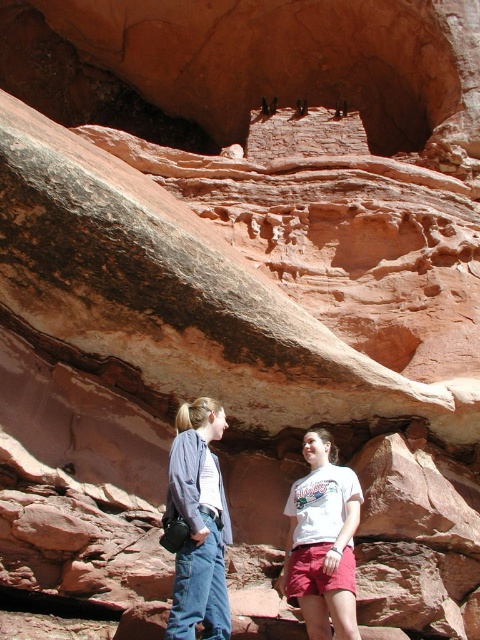
Is denim jacket at lower left thinner than white cotton t-shirt at center?

Yes.

Is point (181, 481) positioned in front of point (288, 493)?

Yes, point (181, 481) is in front of point (288, 493).

Measure the distance between point (175, 465) and camera.

A distance of 40.71 meters exists between point (175, 465) and camera.

You are a GUI agent. You are given a task and a screenshot of the screen. Output one action in this format:
    pyautogui.click(x=<x>, y=<y>)
    Task: Click on the denim jacket at lower left
    
    Given the screenshot: What is the action you would take?
    pyautogui.click(x=199, y=524)

Does matte white t-shirt at center appear on the right side of denim jacket at lower left?

Correct, you'll find matte white t-shirt at center to the right of denim jacket at lower left.

Which of these two, matte white t-shirt at center or denim jacket at lower left, stands taller?

matte white t-shirt at center is taller.

Which is behind, point (331, 442) or point (181, 580)?

The point (331, 442) is behind.

Image resolution: width=480 pixels, height=640 pixels. What are the coordinates of `matte white t-shirt at center` in the screenshot? It's located at (196, 524).

Can you confirm if matte white t-shirt at center is positioned to the left of white cotton t-shirt at center?

Correct, you'll find matte white t-shirt at center to the left of white cotton t-shirt at center.

This screenshot has height=640, width=480. Identify the location of matte white t-shirt at center. (196, 524).

Is point (222, 632) positioned in front of point (335, 621)?

Yes.

At what (x,y) coordinates should I click in order to perform the action: click on matte white t-shirt at center. Please return your answer as a coordinate pair (x, y). The width and height of the screenshot is (480, 640). Looking at the image, I should click on (196, 524).